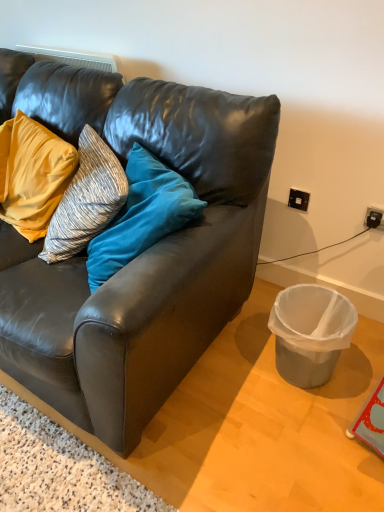
The image size is (384, 512). Identify the location of vacant space to the left of metallic gray trash can at lower right. (243, 373).